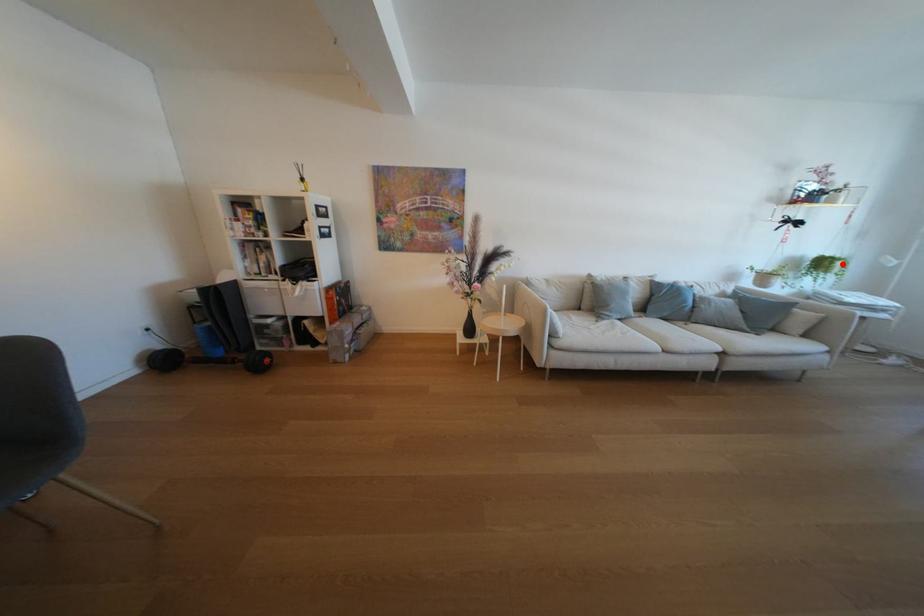
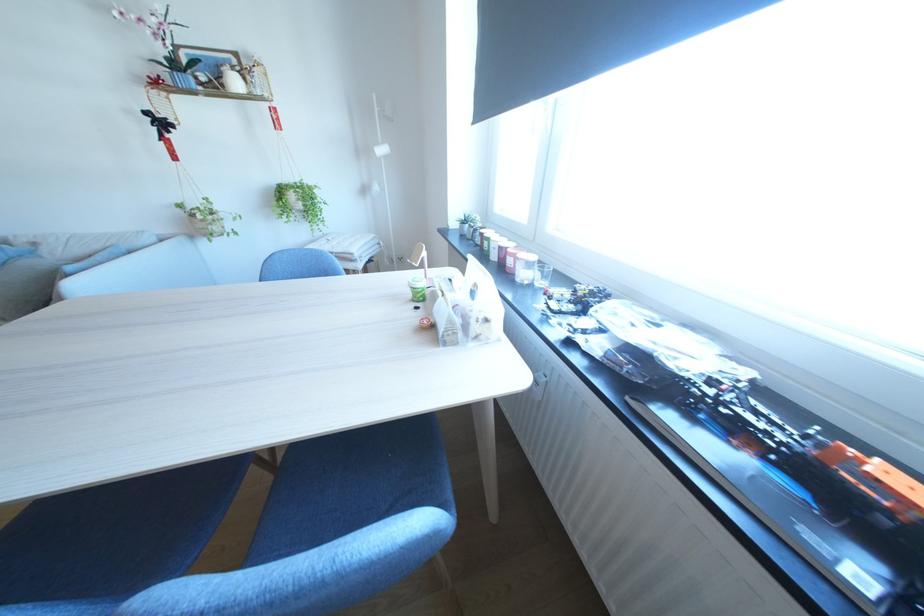
Locate, in the second image, the point that corresponds to the highlighted location in the first image.

(295, 196)